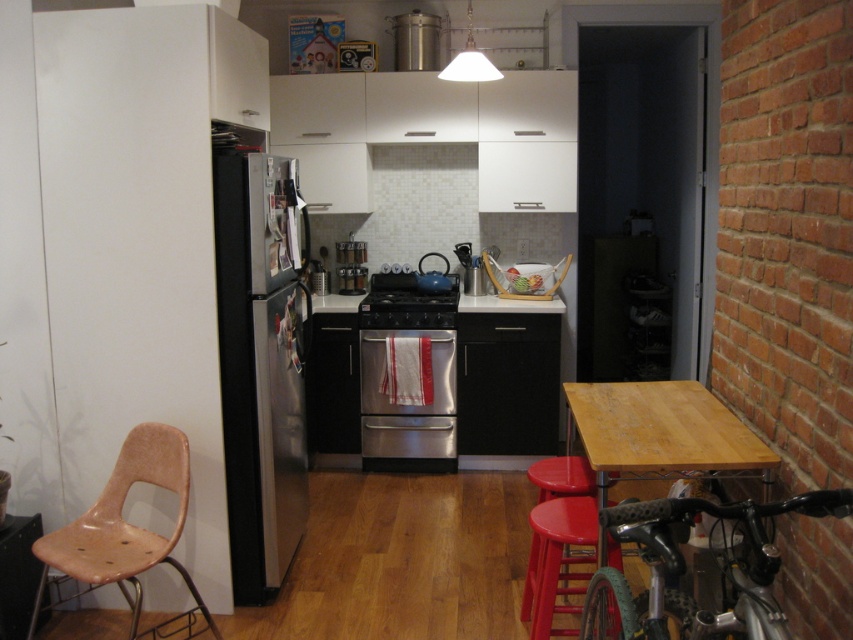
You are a delivery person bringing a package that requires a 1.5 meter clearance to maneuver. You need to move from the brown matte chair at left to the wooden table at right. Based on the kitchen layout, can you pass through the space between them without tilting the package?

The wooden table at right is 1.47 meters from the brown matte chair at left, which is slightly less than the required 1.5 meter clearance. Therefore, you cannot pass through the space between them without tilting the package.